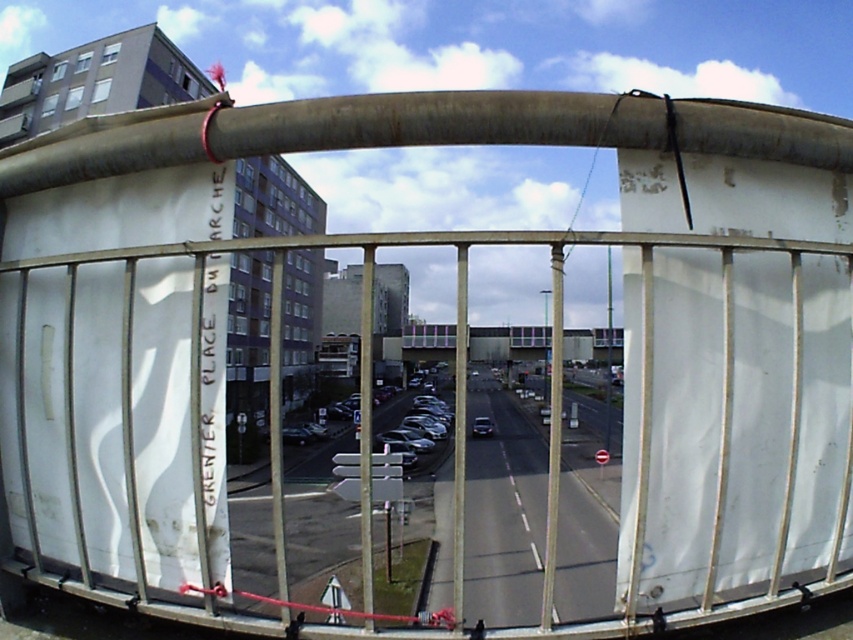
Question: Is concrete bridge at center below shiny black car at center?

Choices:
 (A) no
 (B) yes

Answer: (A)

Question: In this image, where is concrete bridge at center located relative to shiny black car at center?

Choices:
 (A) left
 (B) right

Answer: (B)

Question: Which object appears closest to the camera in this image?

Choices:
 (A) concrete bridge at center
 (B) shiny black car at center

Answer: (A)

Question: Is concrete bridge at center thinner than shiny black car at center?

Choices:
 (A) no
 (B) yes

Answer: (A)

Question: Among these points, which one is nearest to the camera?

Choices:
 (A) (492, 326)
 (B) (476, 422)

Answer: (B)

Question: Among these objects, which one is nearest to the camera?

Choices:
 (A) shiny black car at center
 (B) concrete bridge at center

Answer: (B)